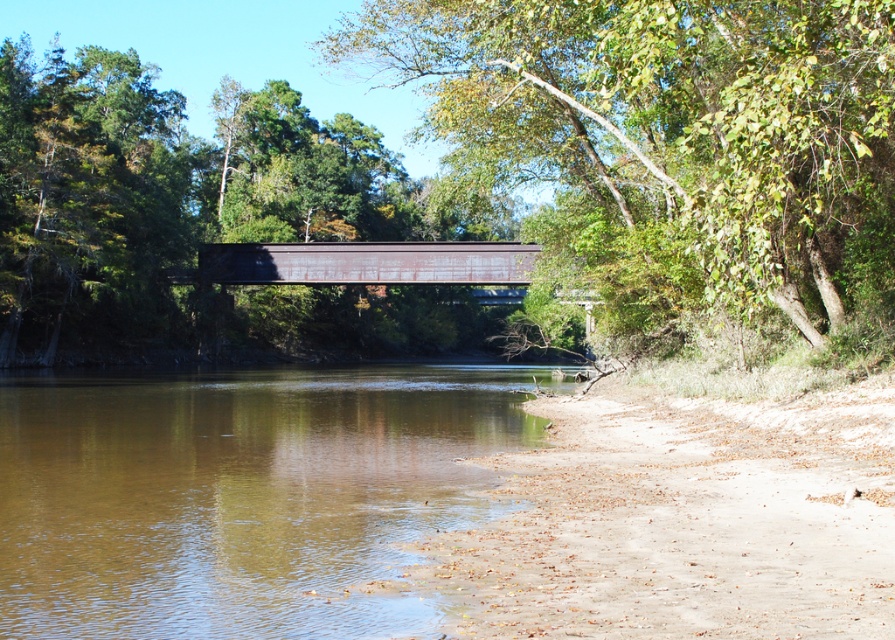
You are standing at the point marked by the coordinates point (x=672, y=140) in the riverside scene. Looking around, you notice the green leafy tree at upper center. What direction is the green leafy tree at upper center located relative to your position?

The green leafy tree at upper center is located at the point marked by the coordinates point (x=672, y=140), which means you are standing right at its location. Therefore, the green leafy tree at upper center is directly at your current position.

You are an artist sketching this riverside scene. You want to ensure the green leafy tree at upper center and the brown sedimentary water at lower left are proportionally accurate. Which object should you draw larger in your sketch?

The green leafy tree at upper center should be drawn larger than the brown sedimentary water at lower left because it is bigger according to the description.